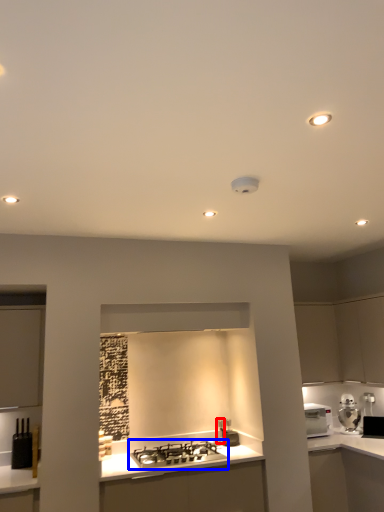
Question: Which of the following is the farthest to the observer, faucet (highlighted by a red box) or gas stove (highlighted by a blue box)?

Choices:
 (A) faucet
 (B) gas stove

Answer: (A)